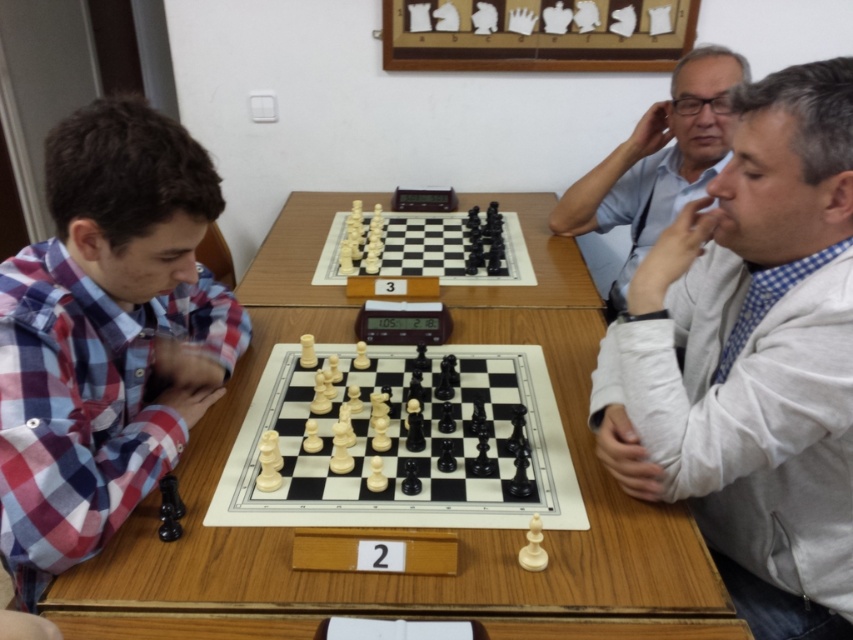
Can you confirm if white shirt at right is positioned to the right of plaid fabric shirt at left?

Yes, white shirt at right is to the right of plaid fabric shirt at left.

Can you confirm if white shirt at right is taller than plaid fabric shirt at left?

Correct, white shirt at right is much taller as plaid fabric shirt at left.

The width and height of the screenshot is (853, 640). I want to click on white shirt at right, so click(x=751, y=358).

Does white shirt at right appear under wooden table at center?

Incorrect, white shirt at right is not positioned below wooden table at center.

Can you confirm if white shirt at right is bigger than wooden table at center?

No.

At what (x,y) coordinates should I click in order to perform the action: click on white shirt at right. Please return your answer as a coordinate pair (x, y). The height and width of the screenshot is (640, 853). Looking at the image, I should click on pyautogui.click(x=751, y=358).

Where is `white shirt at right`? The image size is (853, 640). white shirt at right is located at coordinates (751, 358).

Does polished wood chessboard at center lie behind white plastic chessboard at center?

That is False.

Between polished wood chessboard at center and white plastic chessboard at center, which one appears on the left side from the viewer's perspective?

white plastic chessboard at center is more to the left.

The width and height of the screenshot is (853, 640). Find the location of `polished wood chessboard at center`. polished wood chessboard at center is located at coordinates (404, 445).

At what (x,y) coordinates should I click in order to perform the action: click on polished wood chessboard at center. Please return your answer as a coordinate pair (x, y). Looking at the image, I should click on (404, 445).